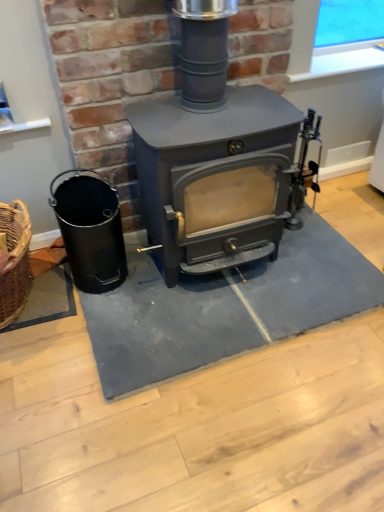
Question: Could you tell me if gray rubber doormat at center is facing matte gray wood burning stove at center?

Choices:
 (A) yes
 (B) no

Answer: (B)

Question: Is gray rubber doormat at center positioned with its back to matte gray wood burning stove at center?

Choices:
 (A) yes
 (B) no

Answer: (B)

Question: From the image's perspective, is gray rubber doormat at center under matte gray wood burning stove at center?

Choices:
 (A) yes
 (B) no

Answer: (A)

Question: Is gray rubber doormat at center in contact with matte gray wood burning stove at center?

Choices:
 (A) yes
 (B) no

Answer: (B)

Question: Is gray rubber doormat at center positioned before matte gray wood burning stove at center?

Choices:
 (A) yes
 (B) no

Answer: (B)

Question: Can matte gray wood burning stove at center be found inside gray rubber doormat at center?

Choices:
 (A) no
 (B) yes

Answer: (A)

Question: Is matte gray wood burning stove at center taller than gray rubber doormat at center?

Choices:
 (A) no
 (B) yes

Answer: (B)

Question: Considering the relative sizes of matte gray wood burning stove at center and gray rubber doormat at center in the image provided, is matte gray wood burning stove at center bigger than gray rubber doormat at center?

Choices:
 (A) no
 (B) yes

Answer: (B)

Question: Is matte gray wood burning stove at center turned away from gray rubber doormat at center?

Choices:
 (A) yes
 (B) no

Answer: (B)

Question: Would you say matte gray wood burning stove at center contains gray rubber doormat at center?

Choices:
 (A) no
 (B) yes

Answer: (A)

Question: Does matte gray wood burning stove at center lie behind gray rubber doormat at center?

Choices:
 (A) no
 (B) yes

Answer: (A)

Question: Is matte gray wood burning stove at center in contact with gray rubber doormat at center?

Choices:
 (A) yes
 (B) no

Answer: (B)

Question: Is matte gray wood burning stove at center at the right side of black matte bucket at left?

Choices:
 (A) yes
 (B) no

Answer: (A)